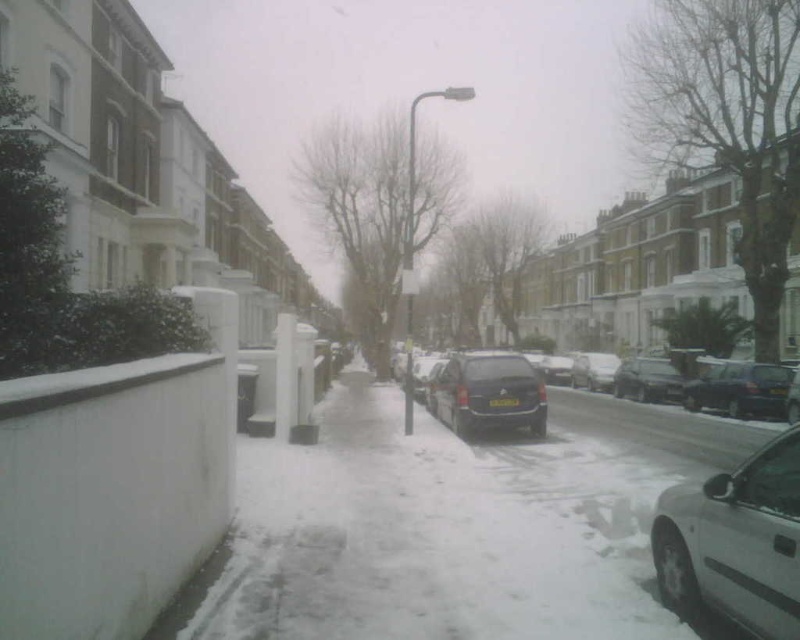
You are a pedestrian standing at the crosswalk in the snowy urban street scene. You see a white matte car at lower right and a dark blue metallic car at right. Which car is closer to you?

The white matte car at lower right is closer to you because it is positioned in front of the dark blue metallic car at right.

You are standing on the snowy street and want to take a photo of the dark gray matte van at center. Where should you position yourself to capture the van in the frame?

The dark gray matte van at center is located at the coordinates [488,394], so positioning yourself directly in front of it at that point would ensure it is centered in your photo.

Consider the image. You are a pedestrian standing at the center of the snowy street. You want to cross the street to reach the residential buildings on the left. There are two cars in your view. The white matte car at lower right and the dark blue metallic car at right. Which car is closer to you?

The white matte car at lower right is closer to you since it is 17.10 meters away from the dark blue metallic car at right, meaning it is positioned in front of the other car from your perspective.